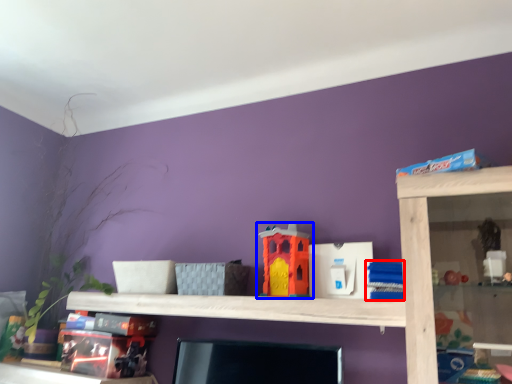
Question: Among these objects, which one is nearest to the camera, toy (highlighted by a red box) or toy (highlighted by a blue box)?

Choices:
 (A) toy
 (B) toy

Answer: (A)